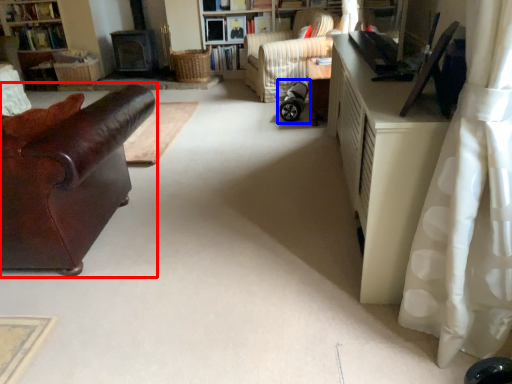
Question: Which object appears closest to the camera in this image, studio couch (highlighted by a red box) or baby carriage (highlighted by a blue box)?

Choices:
 (A) studio couch
 (B) baby carriage

Answer: (A)